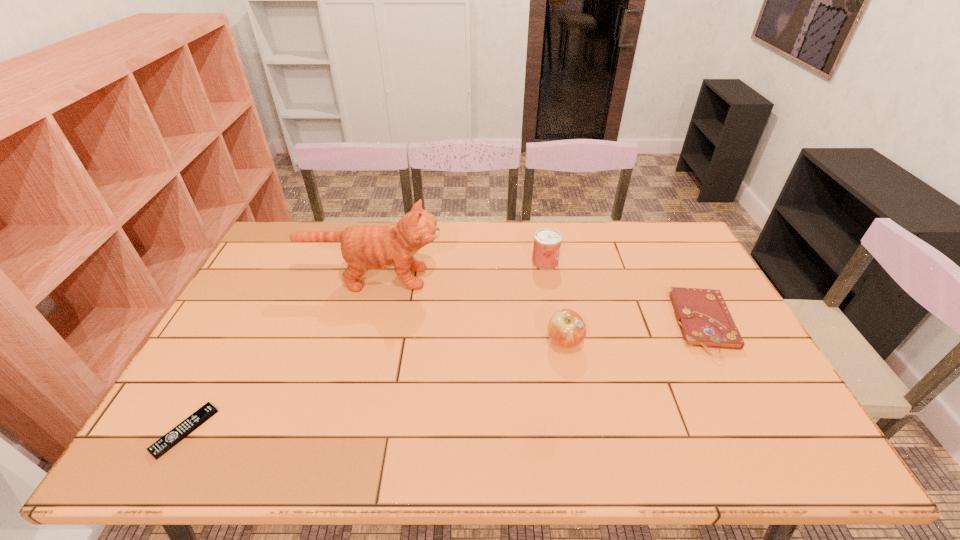
You are a GUI agent. You are given a task and a screenshot of the screen. Output one action in this format:
    pyautogui.click(x=<x>, y=<y>)
    Task: Click on the free area in between the fourth object from right to left and the remote control
    The image size is (960, 540).
    Given the screenshot: What is the action you would take?
    point(279,354)

The width and height of the screenshot is (960, 540). I want to click on vacant area that lies between the notebook and the can, so click(625, 293).

Identify the location of empty space between the tallest object and the apple. The height and width of the screenshot is (540, 960). (468, 310).

What are the coordinates of `free space between the second object from left to right and the apple` in the screenshot? It's located at (468, 310).

At what (x,y) coordinates should I click in order to perform the action: click on vacant point located between the apple and the shortest object. Please return your answer as a coordinate pair (x, y). This screenshot has width=960, height=540. Looking at the image, I should click on (374, 386).

The height and width of the screenshot is (540, 960). In order to click on vacant area that lies between the can and the apple in this screenshot , I will do `click(555, 302)`.

Image resolution: width=960 pixels, height=540 pixels. In order to click on empty space between the fourth tallest object and the apple in this screenshot , I will do `click(635, 333)`.

Locate an element on the screen. free space between the can and the apple is located at coordinates (555, 302).

Identify the location of free space that is in between the remote control and the fourth tallest object. The width and height of the screenshot is (960, 540). (444, 377).

Locate an element on the screen. free space between the can and the cat is located at coordinates (459, 270).